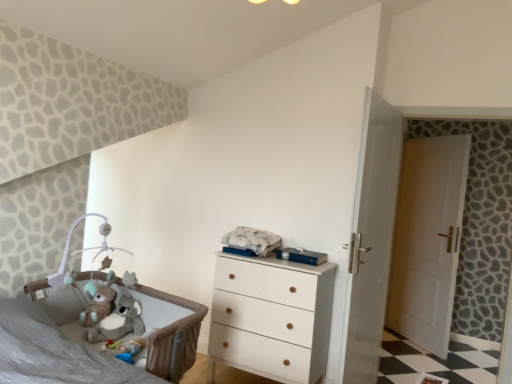
Question: From a real-world perspective, is soft gray fabric infant bed at lower left positioned over white wood chest of drawers at center based on gravity?

Choices:
 (A) no
 (B) yes

Answer: (A)

Question: Can you confirm if soft gray fabric infant bed at lower left is positioned to the left of white wood chest of drawers at center?

Choices:
 (A) yes
 (B) no

Answer: (A)

Question: Considering the relative positions of soft gray fabric infant bed at lower left and white wood chest of drawers at center in the image provided, is soft gray fabric infant bed at lower left in front of white wood chest of drawers at center?

Choices:
 (A) no
 (B) yes

Answer: (B)

Question: From a real-world perspective, does soft gray fabric infant bed at lower left sit lower than white wood chest of drawers at center?

Choices:
 (A) no
 (B) yes

Answer: (B)

Question: Can we say soft gray fabric infant bed at lower left lies outside white wood chest of drawers at center?

Choices:
 (A) yes
 (B) no

Answer: (A)

Question: Is soft gray fabric infant bed at lower left taller than white wood chest of drawers at center?

Choices:
 (A) yes
 (B) no

Answer: (B)

Question: From a real-world perspective, is soft gray fabric infant bed at lower left below white glossy door at center?

Choices:
 (A) yes
 (B) no

Answer: (A)

Question: Does soft gray fabric infant bed at lower left have a smaller size compared to white glossy door at center?

Choices:
 (A) yes
 (B) no

Answer: (B)

Question: Can we say soft gray fabric infant bed at lower left lies outside white glossy door at center?

Choices:
 (A) yes
 (B) no

Answer: (A)

Question: Does soft gray fabric infant bed at lower left turn towards white glossy door at center?

Choices:
 (A) no
 (B) yes

Answer: (A)

Question: Can you confirm if soft gray fabric infant bed at lower left is taller than white glossy door at center?

Choices:
 (A) no
 (B) yes

Answer: (A)

Question: Can you confirm if soft gray fabric infant bed at lower left is thinner than white glossy door at center?

Choices:
 (A) yes
 (B) no

Answer: (B)

Question: Can you confirm if soft gray fabric infant bed at lower left is smaller than white wooden door at right?

Choices:
 (A) no
 (B) yes

Answer: (A)